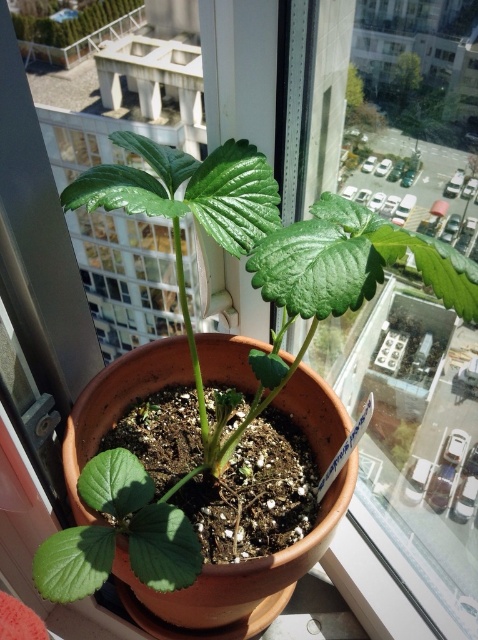
Question: Is green matte leaf at lower left bigger than green matte plant at upper center?

Choices:
 (A) yes
 (B) no

Answer: (A)

Question: Which object is the closest to the green matte leaf at lower left?

Choices:
 (A) green matte plant at upper center
 (B) green matte plant at center

Answer: (B)

Question: Does green matte plant at center appear on the right side of green matte leaf at lower left?

Choices:
 (A) no
 (B) yes

Answer: (B)

Question: Which of the following is the closest to the observer?

Choices:
 (A) green matte plant at center
 (B) green matte leaf at lower left

Answer: (A)

Question: Which object is positioned farthest from the green matte plant at center?

Choices:
 (A) green matte leaf at lower left
 (B) green matte plant at upper center

Answer: (B)

Question: Can you confirm if green matte plant at center is positioned to the left of green matte plant at upper center?

Choices:
 (A) no
 (B) yes

Answer: (A)